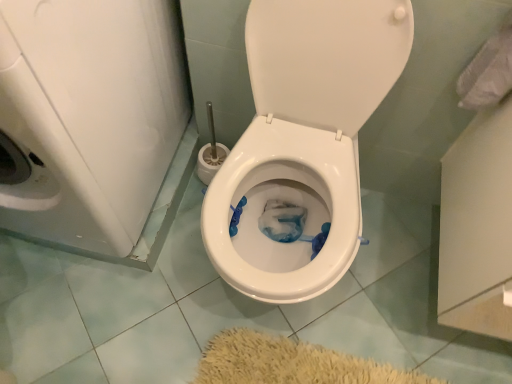
In order to click on free space in front of white glossy toilet at center in this screenshot , I will do `click(256, 356)`.